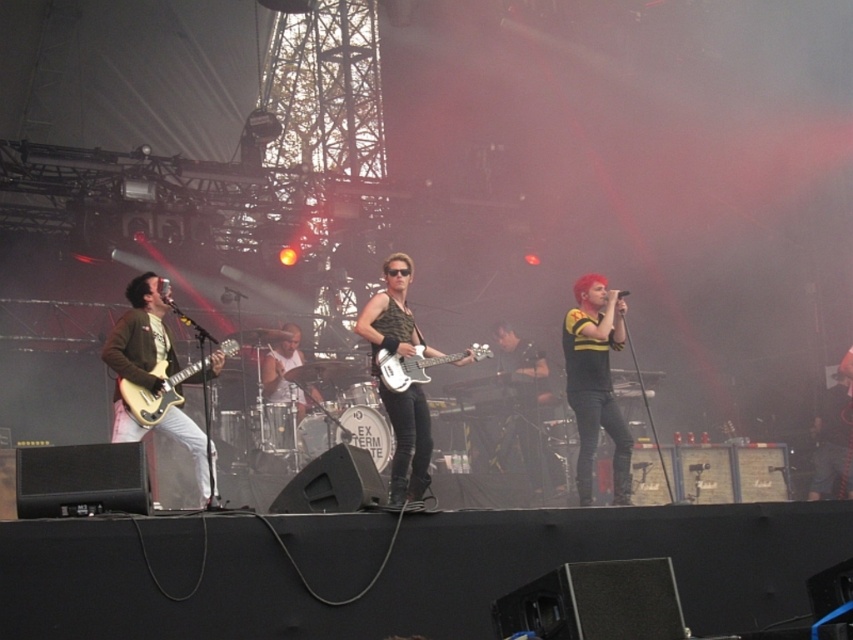
You are a stagehand who needs to adjust the microphone stands for the two guitars. The matte brown electric guitar at left requires a taller stand than the white glossy bass guitar at center. Is this possible based on their positions?

The matte brown electric guitar at left is much taller than the white glossy bass guitar at center, so yes, you can adjust the microphone stands accordingly to accommodate their different heights.

You are standing at the front of the stage and want to walk towards the two points marked in the image. Which point, point (585, 352) or point (136, 422), will you reach first?

You will reach point (585, 352) first because it is closer to you than point (136, 422), which is further away.

You are a stagehand checking the equipment. You notice the shiny black microphone at center and the matte brown electric guitar at left. Which object is wider?

The matte brown electric guitar at left is wider than the shiny black microphone at center.